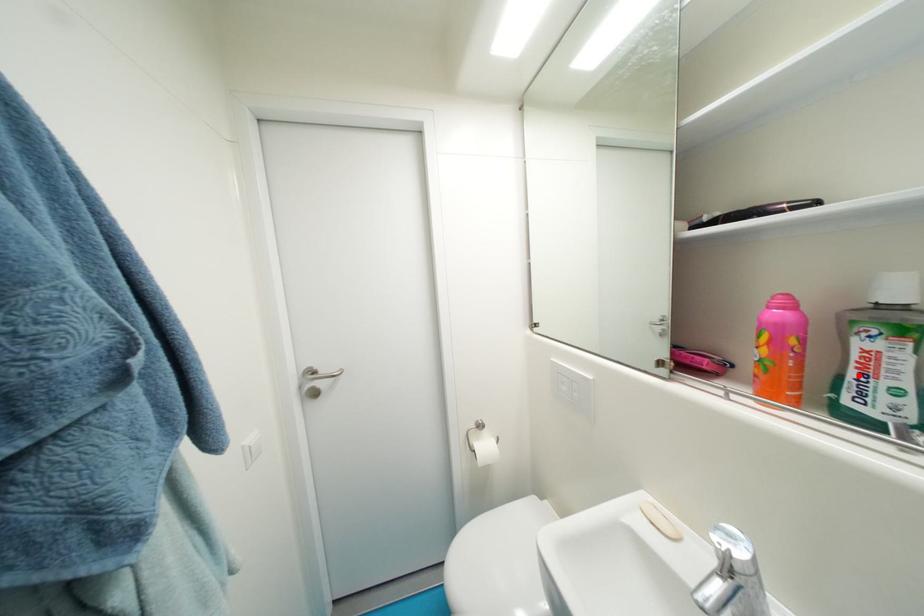
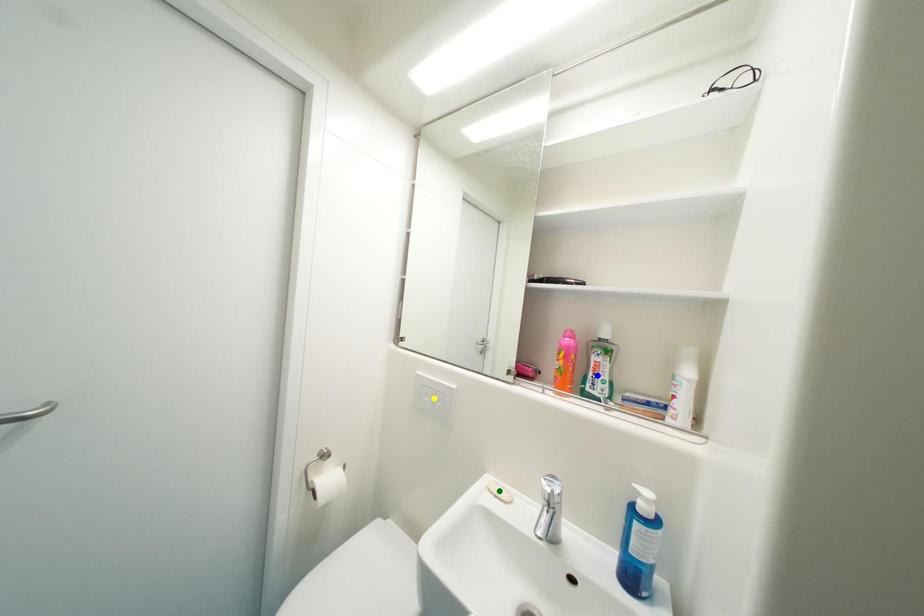
Question: I am providing you with two images of the same scene from different viewpoints. A red point is marked on the first image. You are given multiple points on the second image. In image 2, which mark is for the same physical point as the one in image 1?

Choices:
 (A) blue point
 (B) green point
 (C) yellow point

Answer: (A)